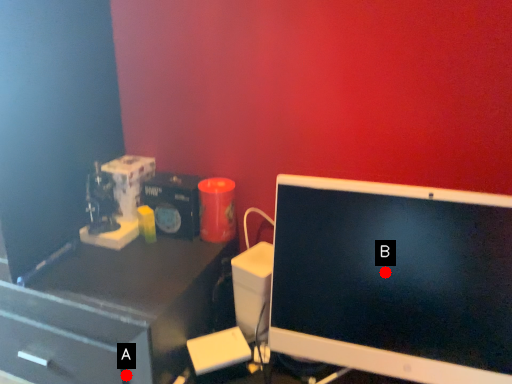
Question: Two points are circled on the image, labeled by A and B beside each circle. Which point is farther to the camera?

Choices:
 (A) A is further
 (B) B is further

Answer: (A)